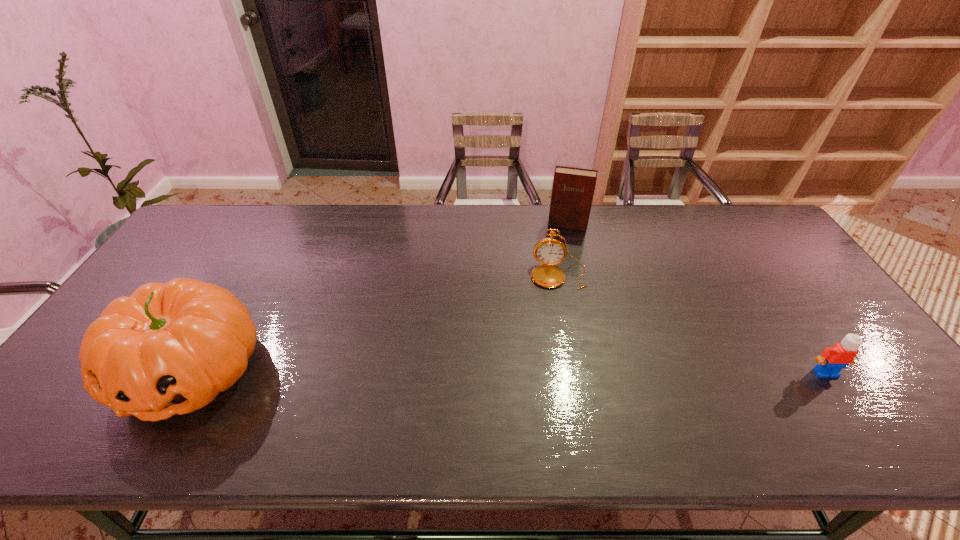
You are a GUI agent. You are given a task and a screenshot of the screen. Output one action in this format:
    pyautogui.click(x=<x>, y=<y>)
    Task: Click on the pumpkin
    The width and height of the screenshot is (960, 540).
    Given the screenshot: What is the action you would take?
    pyautogui.click(x=170, y=348)

You are a GUI agent. You are given a task and a screenshot of the screen. Output one action in this format:
    pyautogui.click(x=<x>, y=<y>)
    Task: Click on the rightmost object
    The width and height of the screenshot is (960, 540).
    Given the screenshot: What is the action you would take?
    pyautogui.click(x=833, y=359)

What are the coordinates of `pocket watch` in the screenshot? It's located at (549, 251).

Image resolution: width=960 pixels, height=540 pixels. I want to click on diary, so click(573, 189).

The height and width of the screenshot is (540, 960). I want to click on the second tallest object, so click(x=573, y=189).

Image resolution: width=960 pixels, height=540 pixels. Find the location of `vacant region located 0.070m on the face of the rightmost object`. vacant region located 0.070m on the face of the rightmost object is located at coordinates (847, 404).

Find the location of a particular element. The height and width of the screenshot is (540, 960). vacant space located 0.330m on the face of the second farthest object is located at coordinates (558, 386).

The image size is (960, 540). What are the coordinates of `free space located on the face of the second farthest object` in the screenshot? It's located at click(x=558, y=404).

The image size is (960, 540). Find the location of `free space located on the face of the second farthest object`. free space located on the face of the second farthest object is located at coordinates (558, 326).

I want to click on vacant region located 0.190m on the front cover of the diary, so click(559, 267).